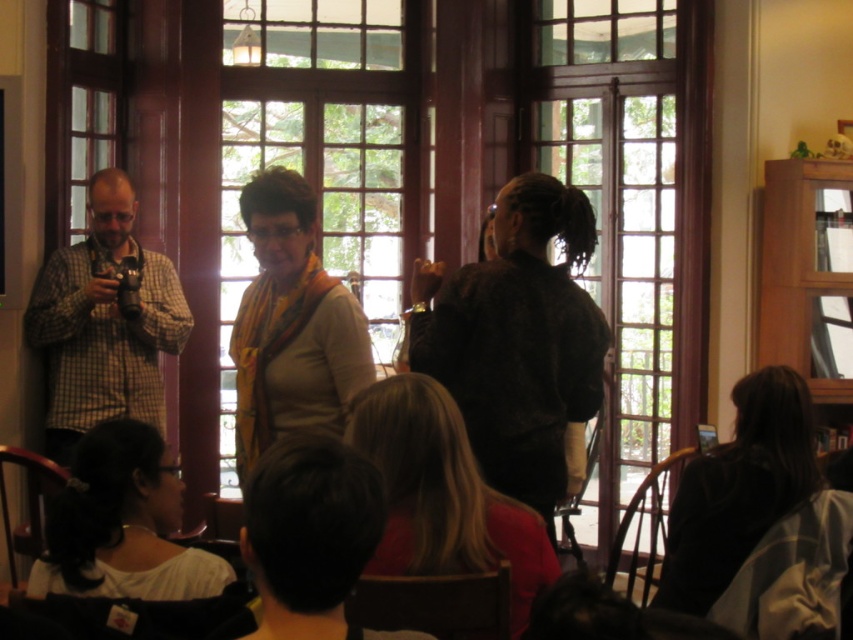
The height and width of the screenshot is (640, 853). What are the coordinates of `checkered fabric shirt at left` in the screenshot? It's located at (103, 323).

Between checkered fabric shirt at left and dark brown hair at lower right, which one appears on the right side from the viewer's perspective?

dark brown hair at lower right

The image size is (853, 640). Describe the element at coordinates (103, 323) in the screenshot. I see `checkered fabric shirt at left` at that location.

The height and width of the screenshot is (640, 853). Find the location of `checkered fabric shirt at left`. checkered fabric shirt at left is located at coordinates (103, 323).

Does matte yellow scarf at center appear on the left side of dark brown hair at lower right?

Indeed, matte yellow scarf at center is positioned on the left side of dark brown hair at lower right.

Between matte yellow scarf at center and dark brown hair at lower right, which one has more height?

matte yellow scarf at center is taller.

What do you see at coordinates (291, 324) in the screenshot? The width and height of the screenshot is (853, 640). I see `matte yellow scarf at center` at bounding box center [291, 324].

Identify the location of matte yellow scarf at center. (291, 324).

Measure the distance between point (163, 589) and camera.

Point (163, 589) and camera are 3.03 meters apart from each other.

Can you confirm if white fabric at lower left is positioned below dark brown hair at lower right?

Incorrect, white fabric at lower left is not positioned below dark brown hair at lower right.

Who is more forward, (166,544) or (672,576)?

Point (166,544)

Identify the location of white fabric at lower left. (x=122, y=524).